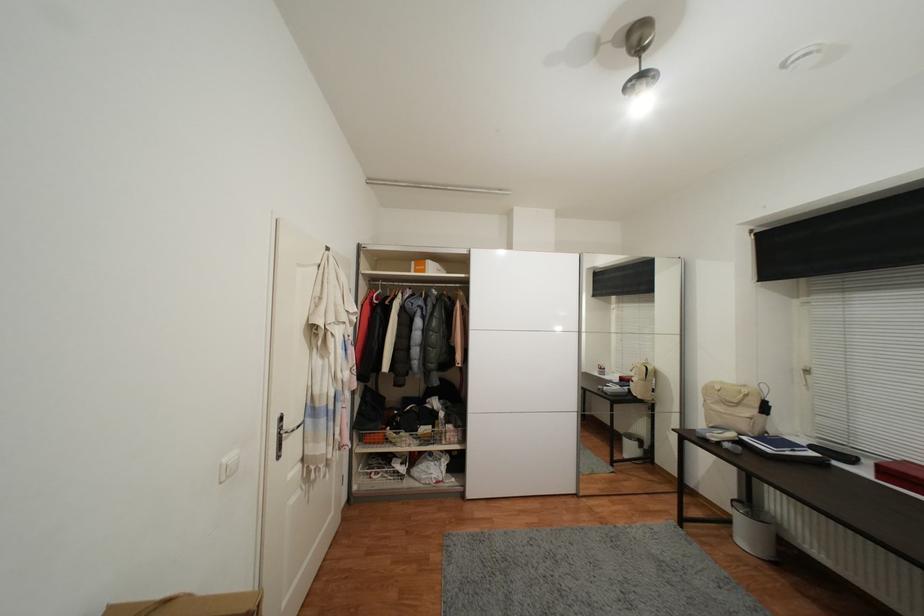
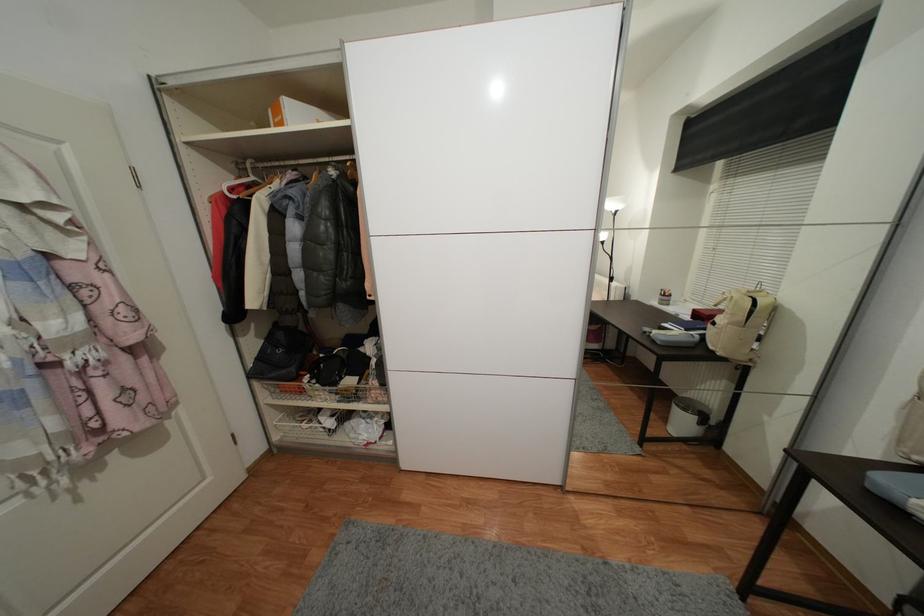
Which direction would the cameraman need to move to produce the second image?

The cameraman walked toward right, forward.